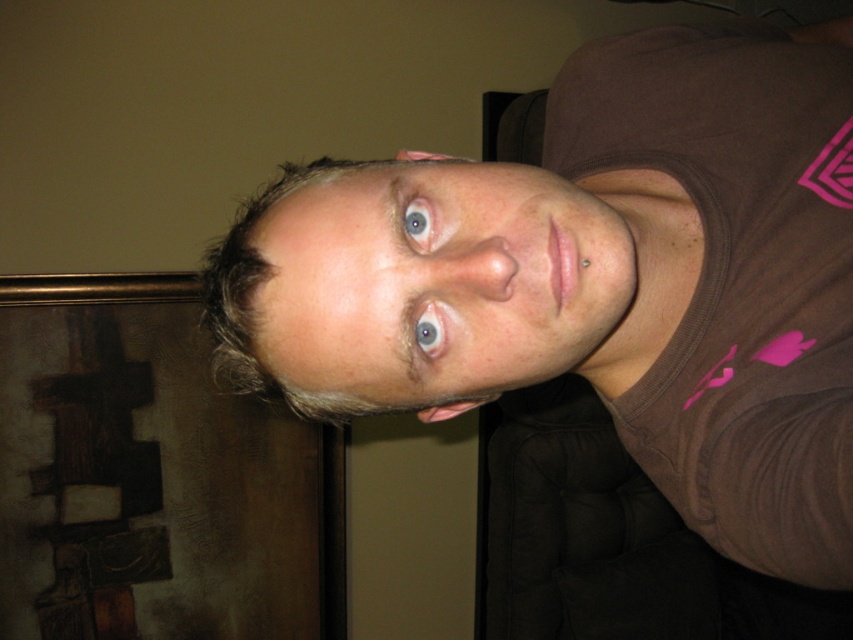
Question: Which of the following is the closest to the observer?

Choices:
 (A) (438, 166)
 (B) (618, 237)
 (C) (422, 321)
 (D) (409, 204)

Answer: (C)

Question: Which object is farther from the camera taking this photo?

Choices:
 (A) pale skin at center
 (B) blue matte eye at center

Answer: (B)

Question: Does blue matte eye at upper center appear on the left side of blue matte eye at center?

Choices:
 (A) no
 (B) yes

Answer: (B)

Question: Does brown cotton shirt at upper center appear on the left side of blue matte eye at upper center?

Choices:
 (A) no
 (B) yes

Answer: (A)

Question: Which point is closer to the camera taking this photo?

Choices:
 (A) (390, 365)
 (B) (421, 237)

Answer: (B)

Question: Is pale skin at center to the left of blue matte eye at center from the viewer's perspective?

Choices:
 (A) yes
 (B) no

Answer: (B)